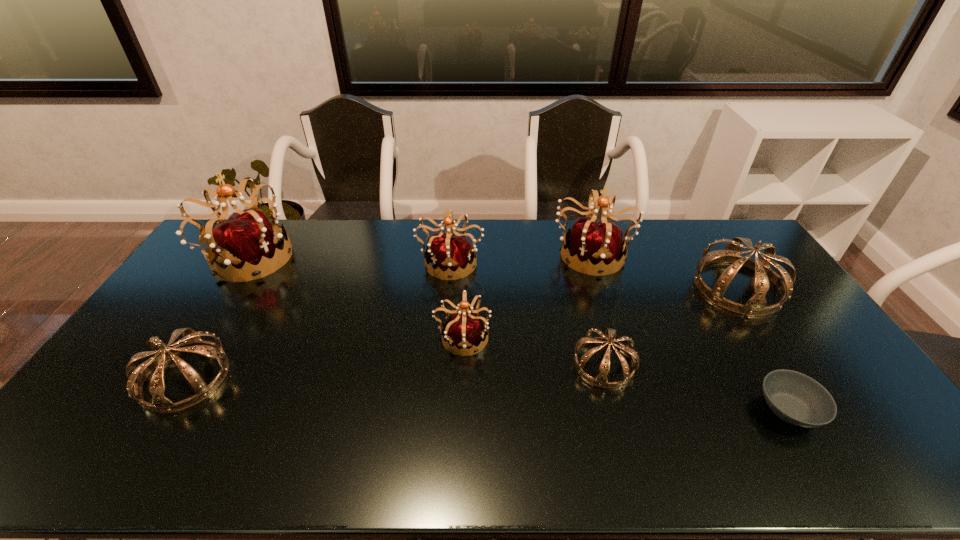
The height and width of the screenshot is (540, 960). I want to click on the biggest red tiara, so click(x=245, y=243).

This screenshot has width=960, height=540. What are the coordinates of `the tallest tiara` in the screenshot? It's located at (245, 243).

Find the location of a particular element. The image size is (960, 540). the second biggest red tiara is located at coordinates (600, 243).

The image size is (960, 540). I want to click on the rightmost red tiara, so click(600, 243).

At what (x,y) coordinates should I click in order to perform the action: click on the third biggest red tiara. Please return your answer as a coordinate pair (x, y). The height and width of the screenshot is (540, 960). Looking at the image, I should click on (453, 254).

Where is `the biggest brown tiara`? The height and width of the screenshot is (540, 960). the biggest brown tiara is located at coordinates (755, 306).

Image resolution: width=960 pixels, height=540 pixels. I want to click on the rightmost brown tiara, so click(x=755, y=306).

Locate an element on the screen. This screenshot has width=960, height=540. the smallest red tiara is located at coordinates (464, 329).

This screenshot has width=960, height=540. Find the location of `the leftmost brown tiara`. the leftmost brown tiara is located at coordinates (193, 343).

Image resolution: width=960 pixels, height=540 pixels. I want to click on the seventh tallest object, so click(x=608, y=337).